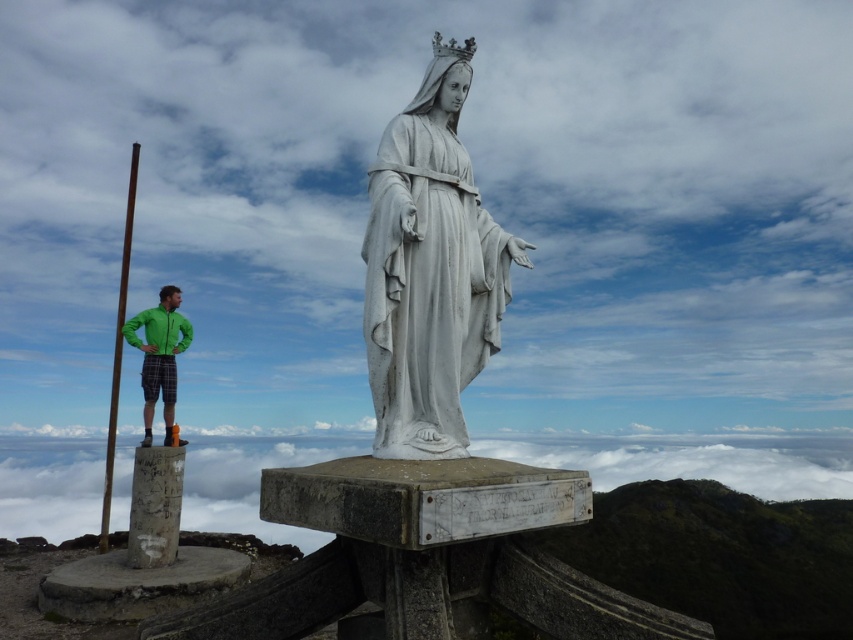
Question: Which object appears closest to the camera in this image?

Choices:
 (A) green fabric jacket at center
 (B) white marble statue at center

Answer: (B)

Question: Is white marble statue at center to the right of smooth brown wooden pole at left from the viewer's perspective?

Choices:
 (A) no
 (B) yes

Answer: (B)

Question: Can you confirm if white marble statue at center is positioned above smooth brown wooden pole at left?

Choices:
 (A) yes
 (B) no

Answer: (B)

Question: Can you confirm if green fabric jacket at center is thinner than smooth brown wooden pole at left?

Choices:
 (A) no
 (B) yes

Answer: (A)

Question: Which of the following is the closest to the observer?

Choices:
 (A) white marble statue at center
 (B) smooth brown wooden pole at left
 (C) green fabric jacket at center

Answer: (A)

Question: Which of these objects is positioned closest to the smooth brown wooden pole at left?

Choices:
 (A) green fabric jacket at center
 (B) white marble statue at center

Answer: (A)